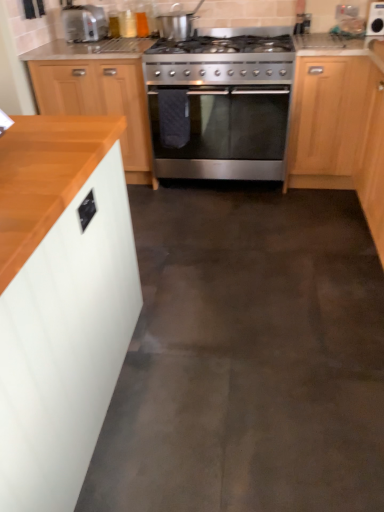
This screenshot has height=512, width=384. I want to click on vacant space underneath satin silver pot at upper center, which ranks as the first appliance in left-to-right order (from a real-world perspective), so click(x=180, y=42).